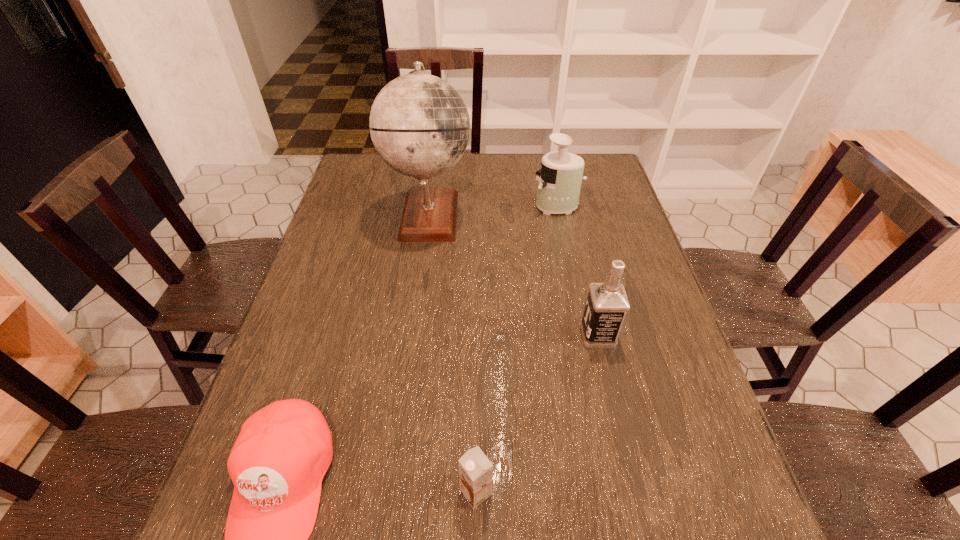
I want to click on the tallest object, so click(419, 124).

Where is `juicer`? juicer is located at coordinates (560, 180).

This screenshot has height=540, width=960. I want to click on the third farthest object, so pos(607,303).

This screenshot has height=540, width=960. I want to click on chocolate milk, so click(475, 470).

You are a GUI agent. You are given a task and a screenshot of the screen. Output one action in this format:
    pyautogui.click(x=<x>, y=<y>)
    Task: Click on the vacant space situated 0.390m at the equator of the globe
    The image size is (960, 540).
    Given the screenshot: What is the action you would take?
    pyautogui.click(x=597, y=214)

The image size is (960, 540). What are the coordinates of `vacant region located on the front of the juicer` in the screenshot? It's located at (580, 315).

What are the coordinates of `vacant region located 0.300m on the front label of the vodka` in the screenshot? It's located at (455, 335).

Where is `free space located 0.170m on the front label of the vodka`? Image resolution: width=960 pixels, height=540 pixels. free space located 0.170m on the front label of the vodka is located at coordinates (510, 335).

At what (x,y) coordinates should I click in order to perform the action: click on free space located on the front label of the vodka. Please return your answer as a coordinate pair (x, y). The height and width of the screenshot is (540, 960). Looking at the image, I should click on (434, 335).

Where is `vacant space located on the right of the chocolate milk`? Image resolution: width=960 pixels, height=540 pixels. vacant space located on the right of the chocolate milk is located at coordinates (670, 492).